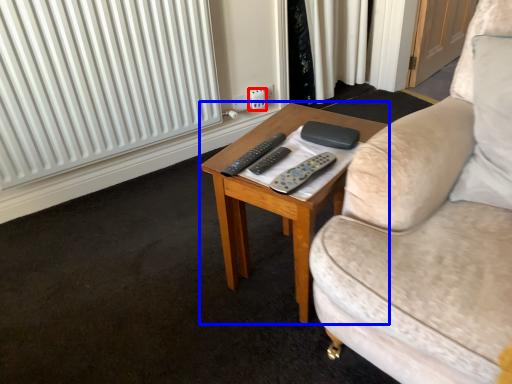
Question: Among these objects, which one is nearest to the camera, electric outlet (highlighted by a red box) or coffee table (highlighted by a blue box)?

Choices:
 (A) electric outlet
 (B) coffee table

Answer: (B)